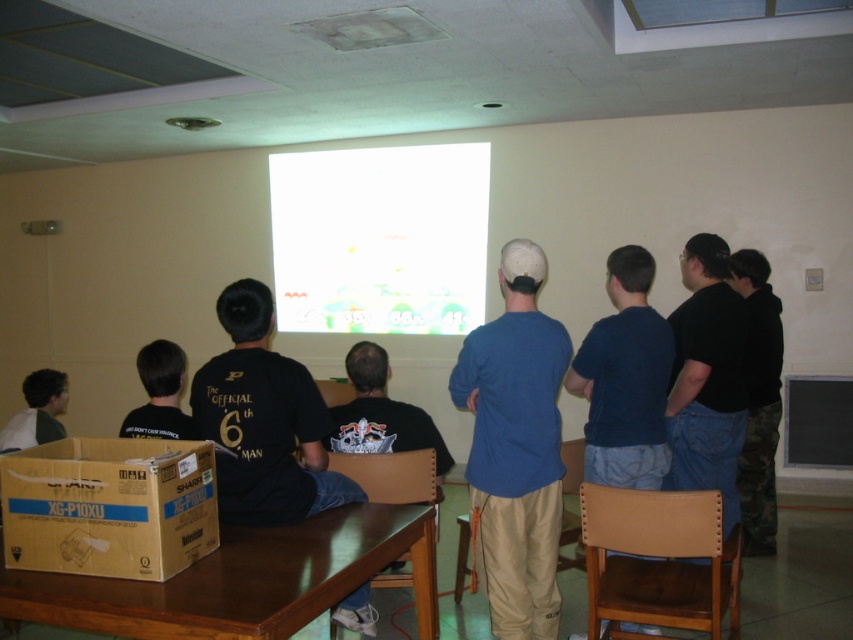
What is the object located at the coordinates point [625,380]?

The object located at point [625,380] is the dark blue t shirt at center.

Based on the scene description, what object is located at the coordinates point (380, 237)?

The point (380, 237) indicates the white glossy projection screen at center.